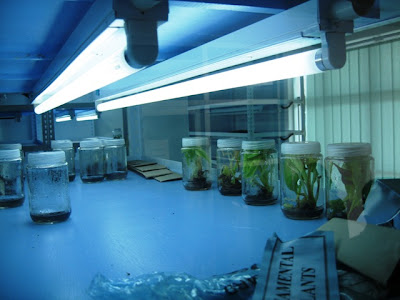
Identify the location of florescent bulb. This screenshot has width=400, height=300. click(251, 75), click(101, 73), click(83, 117), click(59, 121).